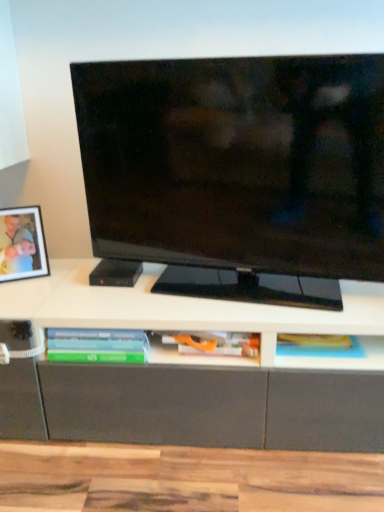
Locate an element on the screen. The height and width of the screenshot is (512, 384). matte black tv at center is located at coordinates (238, 172).

This screenshot has height=512, width=384. What do you see at coordinates (22, 244) in the screenshot?
I see `matte black picture frame at left` at bounding box center [22, 244].

Locate an element on the screen. This screenshot has height=512, width=384. matte orange book at center, the 1th book in the right-to-left sequence is located at coordinates (206, 345).

Image resolution: width=384 pixels, height=512 pixels. Identify the location of matte black tv at center. (238, 172).

From the image's perspective, which one is positioned higher, matte black tv at center or matte orange book at center, the second book when ordered from left to right?

matte black tv at center.

Which is less distant, (228, 283) or (156, 341)?

Point (228, 283) is farther from the camera than point (156, 341).

Can matte orange book at center, the 1th book in the right-to-left sequence, be found inside matte black tv at center?

That's incorrect, matte orange book at center, the 1th book in the right-to-left sequence, is not inside matte black tv at center.

From a real-world perspective, is translucent plastic book at lower center, the 2th book viewed from the right, positioned above or below matte orange book at center, the 1th book in the right-to-left sequence?

translucent plastic book at lower center, the 2th book viewed from the right, is above matte orange book at center, the 1th book in the right-to-left sequence.

In the scene shown: Is translucent plastic book at lower center, the 2th book viewed from the right, at the left side of matte orange book at center, the second book when ordered from left to right?

Correct, you'll find translucent plastic book at lower center, the 2th book viewed from the right, to the left of matte orange book at center, the second book when ordered from left to right.

Which of these two, matte black picture frame at left or translucent plastic book at lower center, arranged as the first book when viewed from the left, stands shorter?

translucent plastic book at lower center, arranged as the first book when viewed from the left, is shorter.

Can we say matte black picture frame at left lies outside translucent plastic book at lower center, arranged as the first book when viewed from the left?

Indeed, matte black picture frame at left is completely outside translucent plastic book at lower center, arranged as the first book when viewed from the left.

Is matte black picture frame at left with translucent plastic book at lower center, arranged as the first book when viewed from the left?

No, matte black picture frame at left is not making contact with translucent plastic book at lower center, arranged as the first book when viewed from the left.

Is matte black picture frame at left smaller than translucent plastic book at lower center, arranged as the first book when viewed from the left?

No.

Between translucent plastic book at lower center, the 2th book viewed from the right, and matte black tv at center, which one is positioned in front?

matte black tv at center is closer to the camera.

Between translucent plastic book at lower center, arranged as the first book when viewed from the left, and matte black tv at center, which one has more height?

matte black tv at center.

In terms of size, does translucent plastic book at lower center, the 2th book viewed from the right, appear bigger or smaller than matte black tv at center?

In the image, translucent plastic book at lower center, the 2th book viewed from the right, appears to be smaller than matte black tv at center.

Is translucent plastic book at lower center, arranged as the first book when viewed from the left, in front of or behind matte black picture frame at left in the image?

In the image, translucent plastic book at lower center, arranged as the first book when viewed from the left, appears in front of matte black picture frame at left.

Is translucent plastic book at lower center, the 2th book viewed from the right, outside of matte black picture frame at left?

translucent plastic book at lower center, the 2th book viewed from the right, is positioned outside matte black picture frame at left.

Between point (62, 332) and point (3, 237), which one is positioned in front?

Point (62, 332)

From a real-world perspective, which book is the 1st one underneath the matte black picture frame at left? Please provide its 2D coordinates.

[(97, 345)]

Could you tell me if matte black picture frame at left is facing matte black tv at center?

No, matte black picture frame at left is not oriented towards matte black tv at center.

Consider the image. Can you tell me how much matte black picture frame at left and matte black tv at center differ in facing direction?

34 degrees.

In terms of height, does matte black picture frame at left look taller or shorter compared to matte black tv at center?

matte black picture frame at left is shorter than matte black tv at center.

Which object is more forward, matte black picture frame at left or matte black tv at center?

matte black tv at center is in front.

Looking at this image, which of these two, matte black tv at center or translucent plastic book at lower center, arranged as the first book when viewed from the left, is smaller?

translucent plastic book at lower center, arranged as the first book when viewed from the left.

From a real-world perspective, does matte black tv at center stand above translucent plastic book at lower center, arranged as the first book when viewed from the left?

Correct, in the physical world, matte black tv at center is higher than translucent plastic book at lower center, arranged as the first book when viewed from the left.

Between matte black tv at center and translucent plastic book at lower center, the 2th book viewed from the right, which one has smaller width?

With smaller width is matte black tv at center.

Is matte black tv at center not near translucent plastic book at lower center, arranged as the first book when viewed from the left?

matte black tv at center is near translucent plastic book at lower center, arranged as the first book when viewed from the left, not far away.

The height and width of the screenshot is (512, 384). In order to click on the 1st book to the left of the matte black tv at center, starting your count from the anchor in this screenshot , I will do `click(206, 345)`.

The height and width of the screenshot is (512, 384). I want to click on book in front of the translucent plastic book at lower center, the 2th book viewed from the right, so click(x=206, y=345).

Based on their spatial positions, is matte orange book at center, the 1th book in the right-to-left sequence, or matte black picture frame at left closer to translucent plastic book at lower center, arranged as the first book when viewed from the left?

matte orange book at center, the 1th book in the right-to-left sequence, lies closer to translucent plastic book at lower center, arranged as the first book when viewed from the left, than the other object.

Considering their positions, is matte black picture frame at left positioned further to translucent plastic book at lower center, the 2th book viewed from the right, than matte orange book at center, the 1th book in the right-to-left sequence?

matte black picture frame at left lies further to translucent plastic book at lower center, the 2th book viewed from the right, than the other object.

Based on their spatial positions, is translucent plastic book at lower center, the 2th book viewed from the right, or matte black picture frame at left further from matte black tv at center?

The object further to matte black tv at center is matte black picture frame at left.

From the image, which object appears to be nearer to translucent plastic book at lower center, arranged as the first book when viewed from the left, matte black picture frame at left or matte black tv at center?

matte black picture frame at left.

Which object lies further to the anchor point matte black picture frame at left, matte black tv at center or translucent plastic book at lower center, arranged as the first book when viewed from the left?

Based on the image, matte black tv at center appears to be further to matte black picture frame at left.

Which object lies nearer to the anchor point matte black tv at center, matte orange book at center, the 1th book in the right-to-left sequence, or matte black picture frame at left?

The object closer to matte black tv at center is matte orange book at center, the 1th book in the right-to-left sequence.

When comparing their distances from matte black tv at center, does matte orange book at center, the 1th book in the right-to-left sequence, or translucent plastic book at lower center, the 2th book viewed from the right, seem further?

translucent plastic book at lower center, the 2th book viewed from the right.

From the image, which object appears to be farther from matte black tv at center, matte black picture frame at left or matte orange book at center, the 1th book in the right-to-left sequence?

Based on the image, matte black picture frame at left appears to be further to matte black tv at center.

Identify the location of book between matte black tv at center and matte orange book at center, the 1th book in the right-to-left sequence, in the up-down direction. (97, 345).

Find the location of a particular element. This screenshot has height=512, width=384. book located between matte black picture frame at left and matte orange book at center, the second book when ordered from left to right, in the left-right direction is located at coordinates (97, 345).